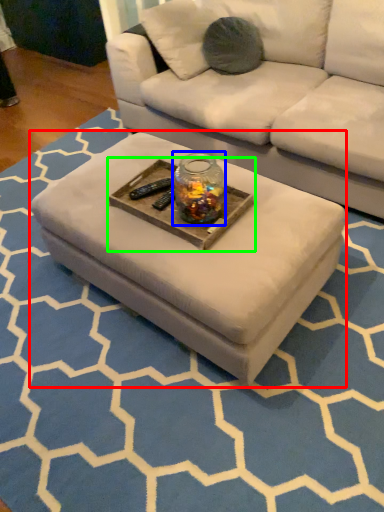
Question: Which is nearer to the coffee table (highlighted by a red box)? glass jar (highlighted by a blue box) or round table (highlighted by a green box).

Choices:
 (A) glass jar
 (B) round table

Answer: (B)